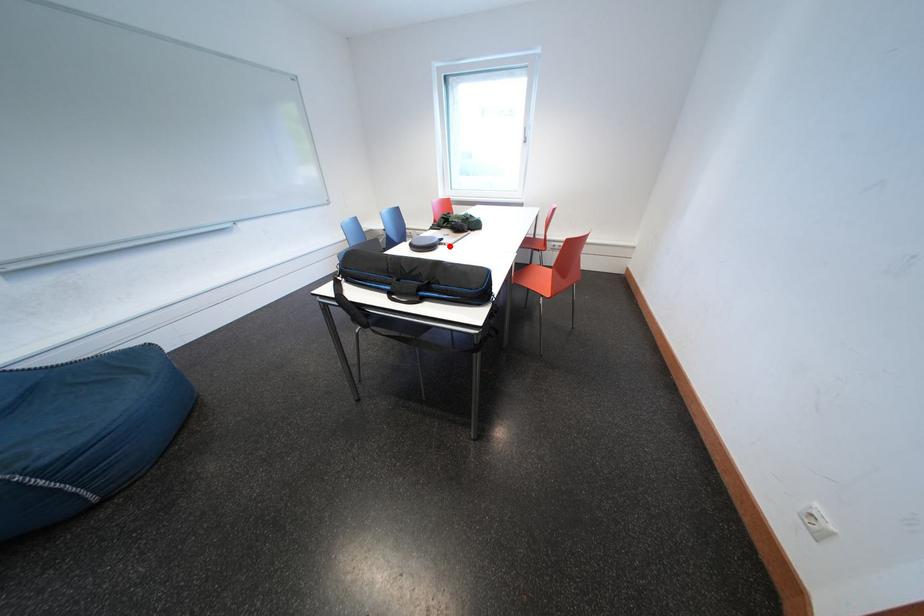
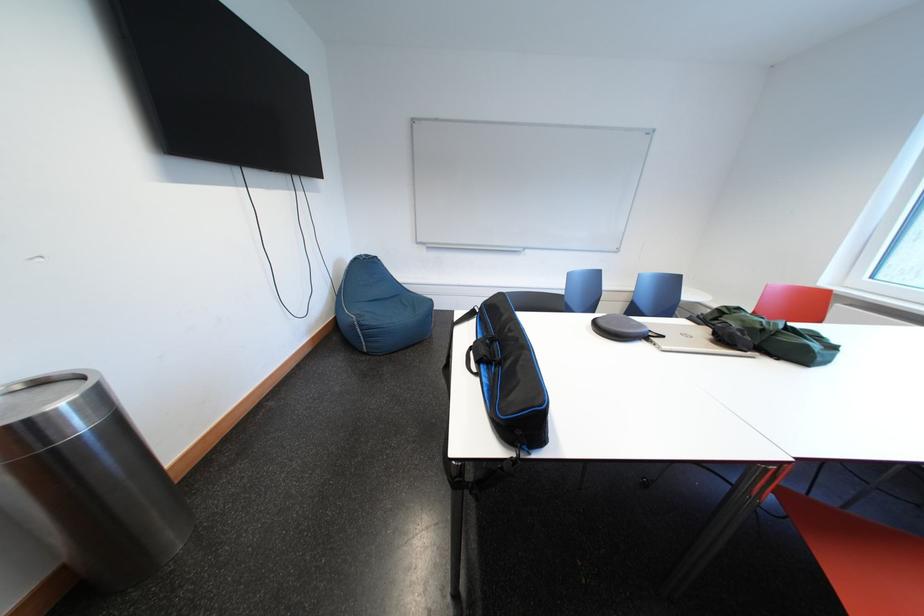
The point at the highlighted location is marked in the first image. Where is the corresponding point in the second image?

(657, 341)